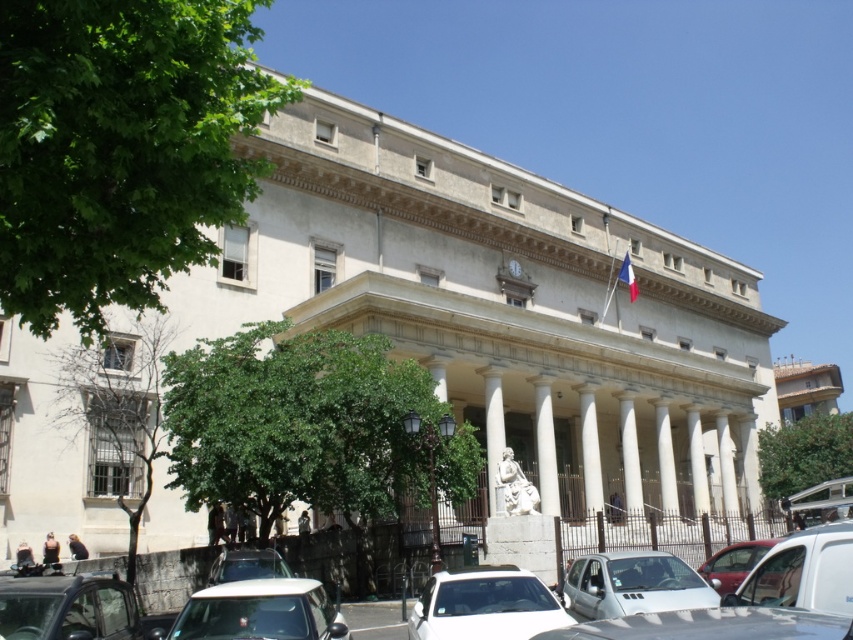
Question: Can you confirm if white matte van at lower right is smaller than metallic red car at lower right?

Choices:
 (A) no
 (B) yes

Answer: (B)

Question: Which point is closer to the camera?

Choices:
 (A) white matte car at lower center
 (B) white matte van at lower right
 (C) shiny silver car at lower right

Answer: (C)

Question: Does white matte van at lower right appear on the left side of metallic silver car at lower center?

Choices:
 (A) no
 (B) yes

Answer: (A)

Question: Among these points, which one is nearest to the camera?

Choices:
 (A) (273, 548)
 (B) (604, 627)

Answer: (B)

Question: Which of the following is the farthest from the observer?

Choices:
 (A) metallic silver car at lower left
 (B) shiny silver car at lower right
 (C) metallic red car at lower right
 (D) white matte van at lower right

Answer: (C)

Question: Is white matte car at lower center closer to camera compared to metallic silver car at lower center?

Choices:
 (A) yes
 (B) no

Answer: (A)